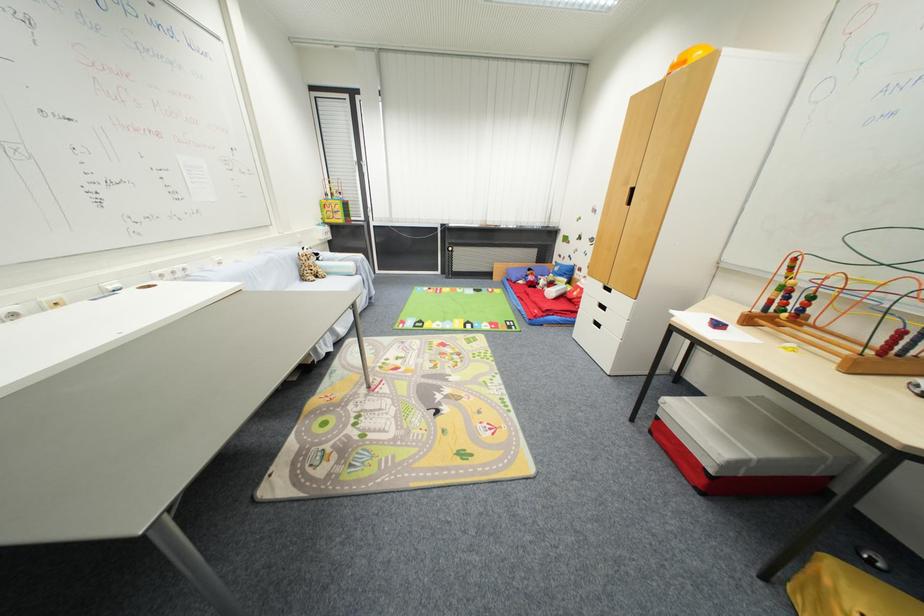
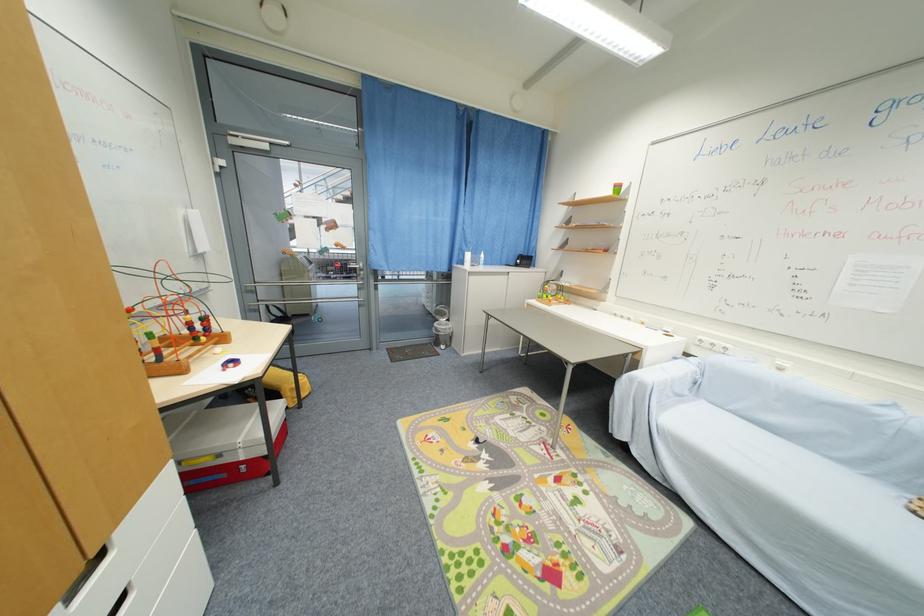
The point at (789, 313) is marked in the first image. Where is the corresponding point in the second image?

(201, 341)